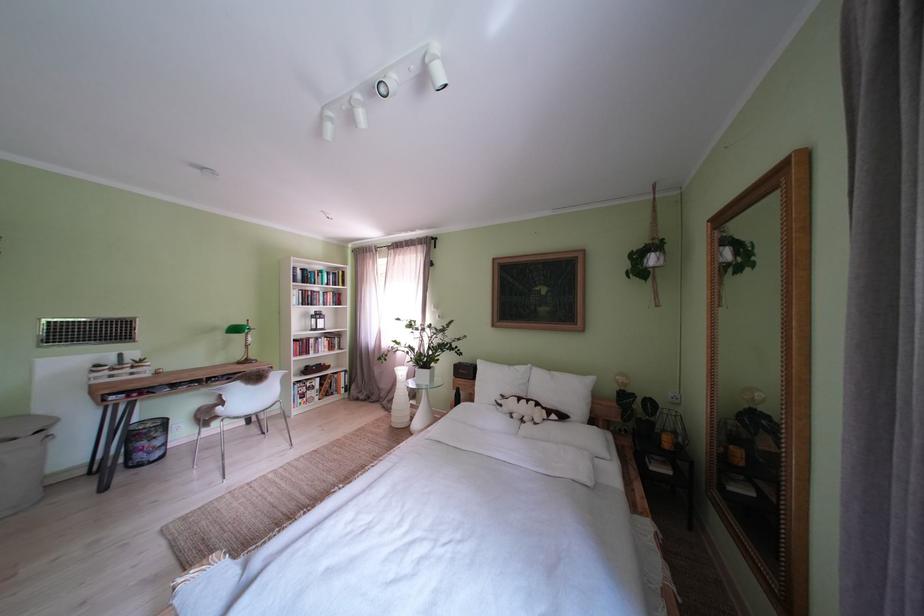
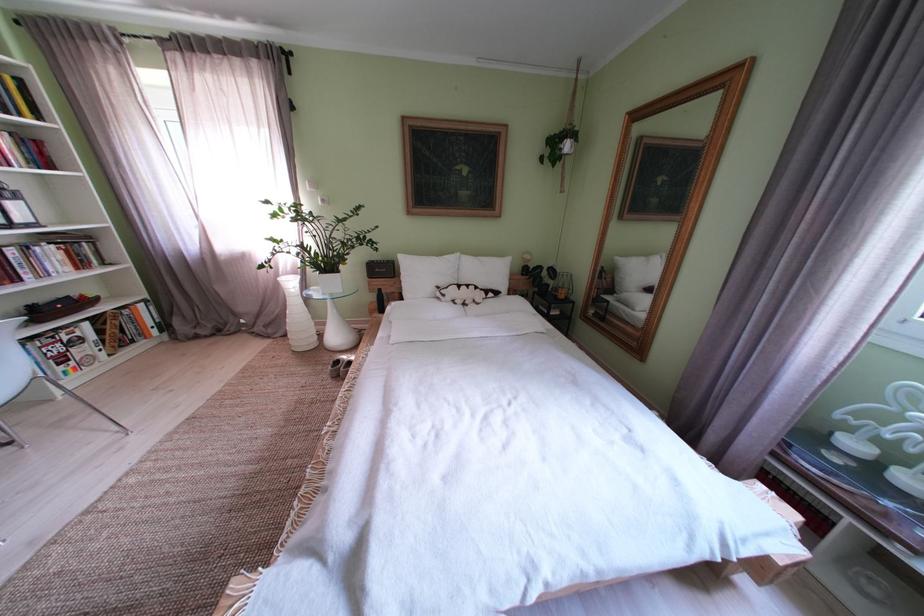
Where in the second image is the point corresponding to (406,411) from the first image?

(301, 334)